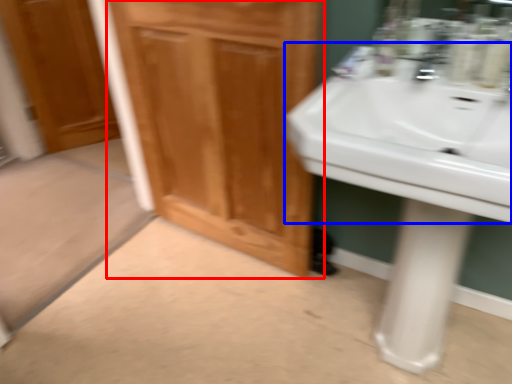
Question: Among these objects, which one is farthest to the camera, bathroom cabinet (highlighted by a red box) or sink (highlighted by a blue box)?

Choices:
 (A) bathroom cabinet
 (B) sink

Answer: (A)